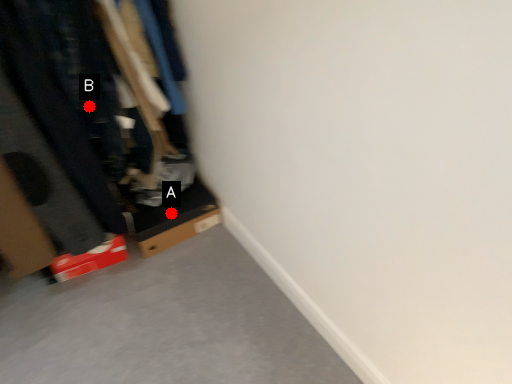
Question: Two points are circled on the image, labeled by A and B beside each circle. Which point is closer to the camera taking this photo?

Choices:
 (A) A is closer
 (B) B is closer

Answer: (B)